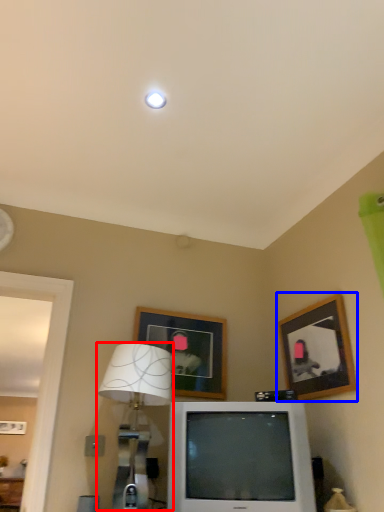
Question: Among these objects, which one is nearest to the camera, table lamp (highlighted by a red box) or picture frame (highlighted by a blue box)?

Choices:
 (A) table lamp
 (B) picture frame

Answer: (A)